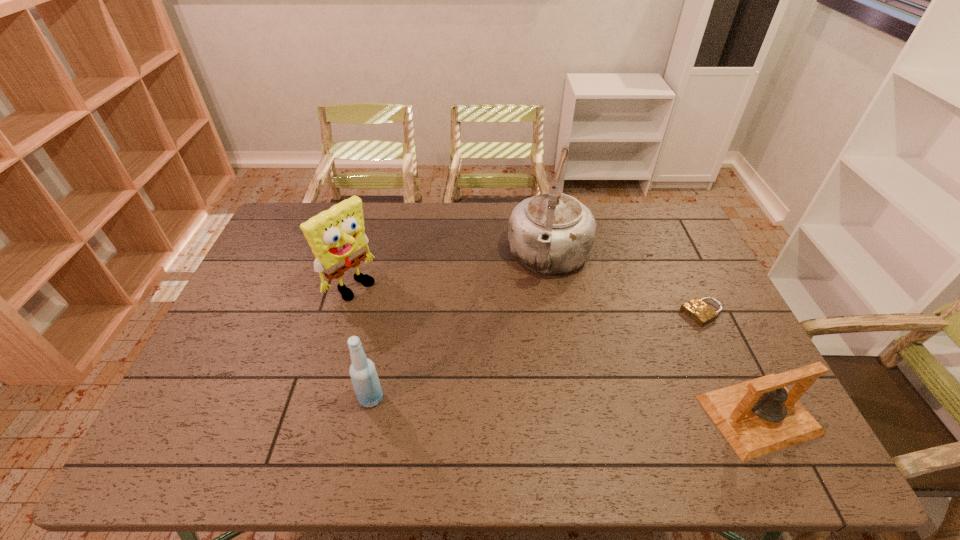
Where is `free space located at the spout of the third object from left to right`? free space located at the spout of the third object from left to right is located at coordinates (521, 376).

Identify the location of vacant area located at the spout of the third object from left to right. (519, 382).

This screenshot has width=960, height=540. In order to click on vacant space situated at the spout of the third object from left to right in this screenshot , I will do `click(527, 353)`.

The image size is (960, 540). I want to click on free space located 0.100m on the face of the leftmost object, so click(x=388, y=312).

The width and height of the screenshot is (960, 540). I want to click on vacant space positioned on the face of the leftmost object, so click(411, 329).

Locate an element on the screen. Image resolution: width=960 pixels, height=540 pixels. blank space located on the face of the leftmost object is located at coordinates (388, 312).

In order to click on free location located on the keyhole side of the padlock in this screenshot , I will do `click(623, 354)`.

At what (x,y) coordinates should I click in order to perform the action: click on vacant area situated 0.350m on the keyhole side of the padlock. Please return your answer as a coordinate pair (x, y). Looking at the image, I should click on (595, 369).

What are the coordinates of `vacant space located 0.280m on the keyhole side of the padlock` in the screenshot? It's located at (615, 359).

Find the location of a particular element. The width and height of the screenshot is (960, 540). object at the far edge is located at coordinates (552, 233).